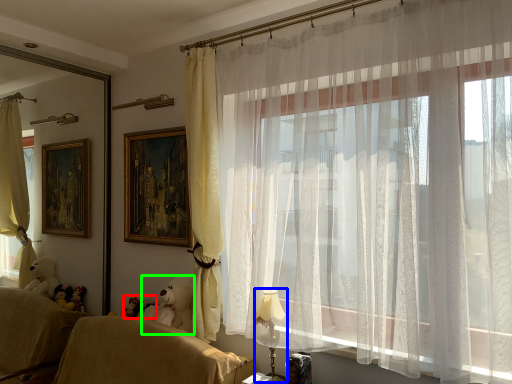
Question: Which object is positioned farthest from toy (highlighted by a red box)? Select from table lamp (highlighted by a blue box) and animal (highlighted by a green box).

Choices:
 (A) table lamp
 (B) animal

Answer: (A)